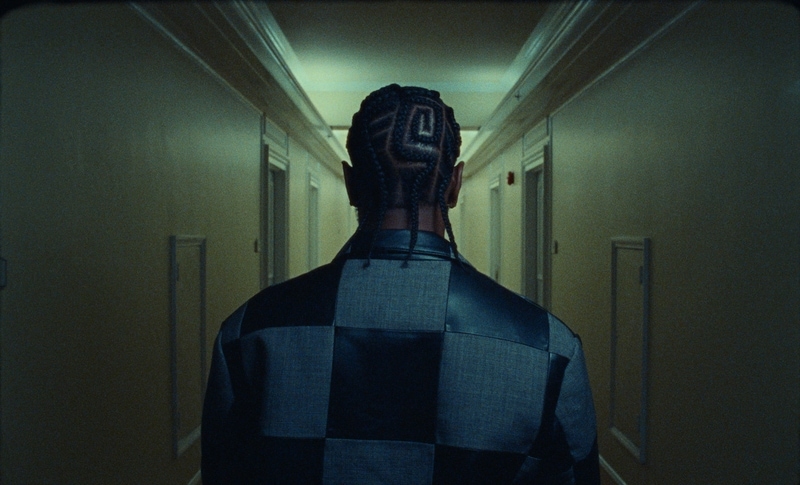
Locate an element on the screen. semi-transparent lines running down the hall on the ceiling is located at coordinates 260,55, 526,86.